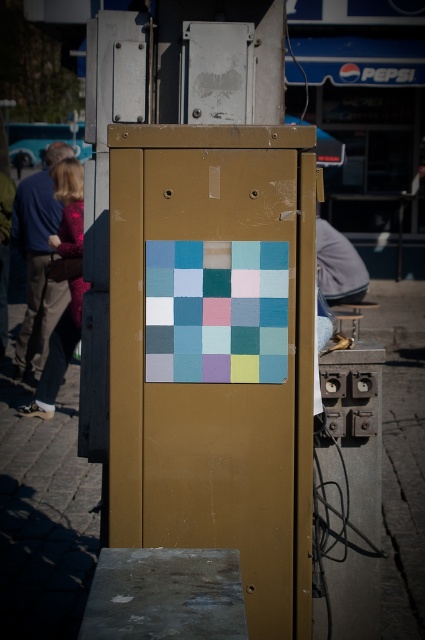
Question: Can you confirm if gold metallic phone box at center is positioned below matte concrete pavement at center?

Choices:
 (A) no
 (B) yes

Answer: (A)

Question: Based on their relative distances, which object is farther from the gold metallic phone box at center?

Choices:
 (A) wooden stool at center
 (B) wooden stool at right

Answer: (A)

Question: Which point appears farthest from the camera in this image?

Choices:
 (A) (393, 580)
 (B) (302, 228)
 (C) (348, 304)
 (D) (336, 248)

Answer: (D)

Question: Is matte blue shirt at left wider than gray fabric at right?

Choices:
 (A) yes
 (B) no

Answer: (A)

Question: Which of these objects is positioned farthest from the gray fabric at right?

Choices:
 (A) matte concrete pavement at center
 (B) matte blue shirt at left
 (C) gold metallic phone box at center
 (D) wooden stool at center

Answer: (C)

Question: Is the position of gold metallic phone box at center more distant than that of wooden stool at center?

Choices:
 (A) yes
 (B) no

Answer: (B)